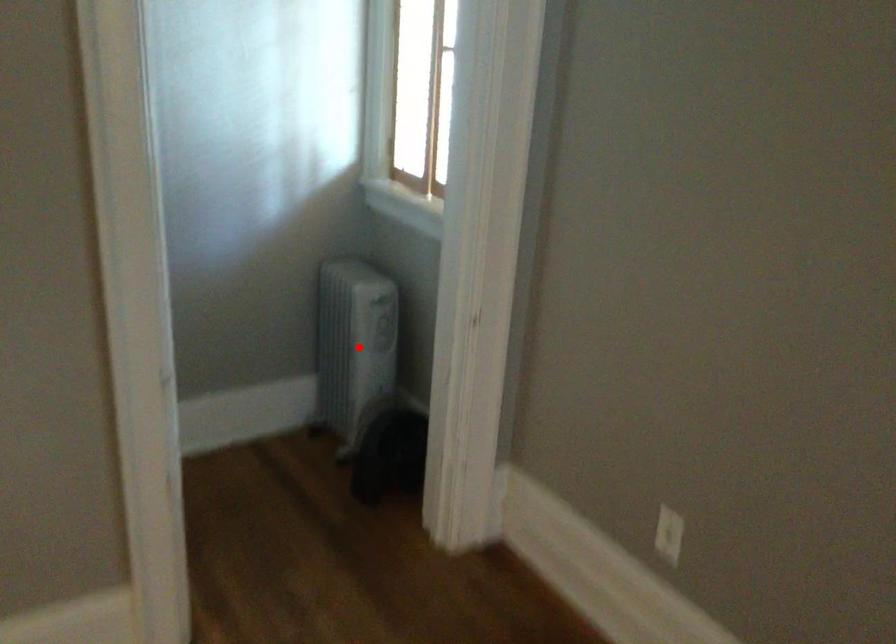
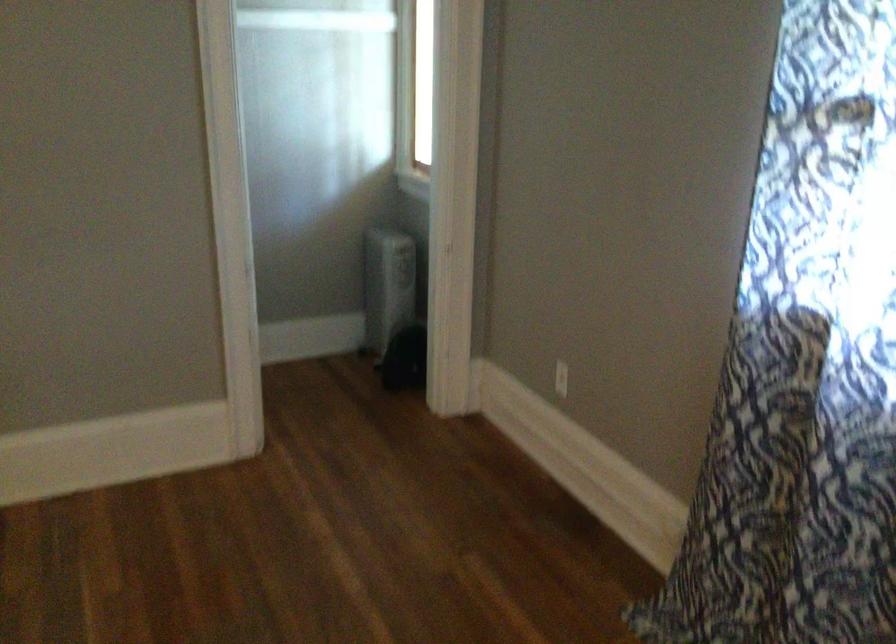
Question: I am providing you with two images of the same scene from different viewpoints. A red point is shown in image1. For the corresponding object point in image2, is it positioned nearer or farther from the camera?

Choices:
 (A) Nearer
 (B) Farther

Answer: (B)